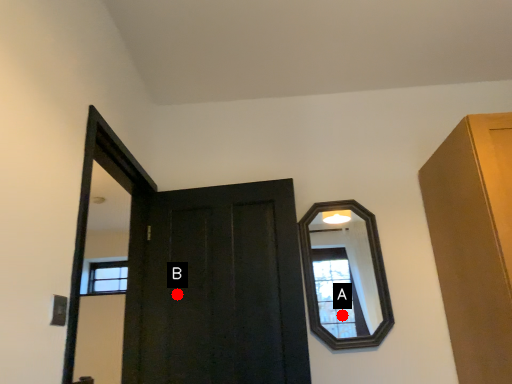
Question: Two points are circled on the image, labeled by A and B beside each circle. Which point is closer to the camera?

Choices:
 (A) A is closer
 (B) B is closer

Answer: (A)